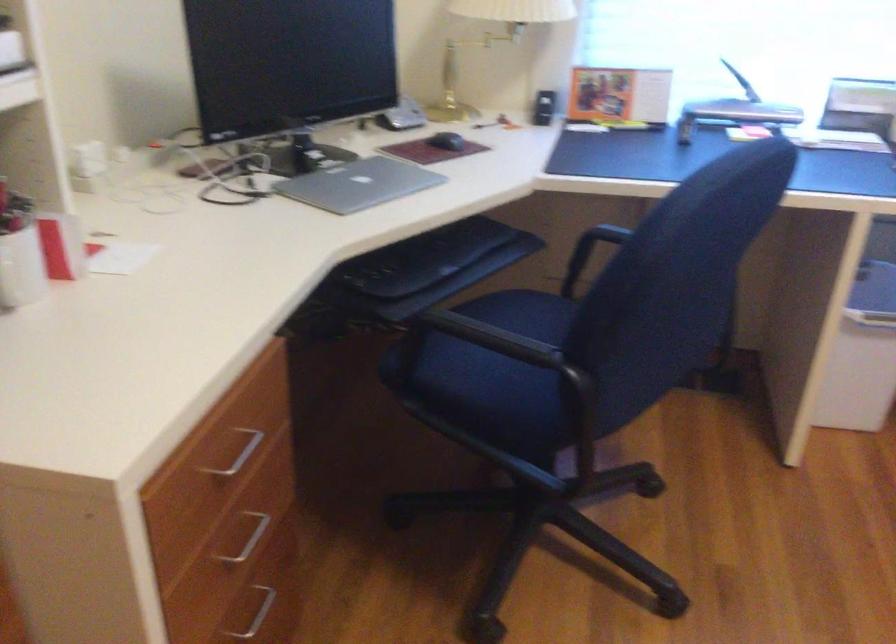
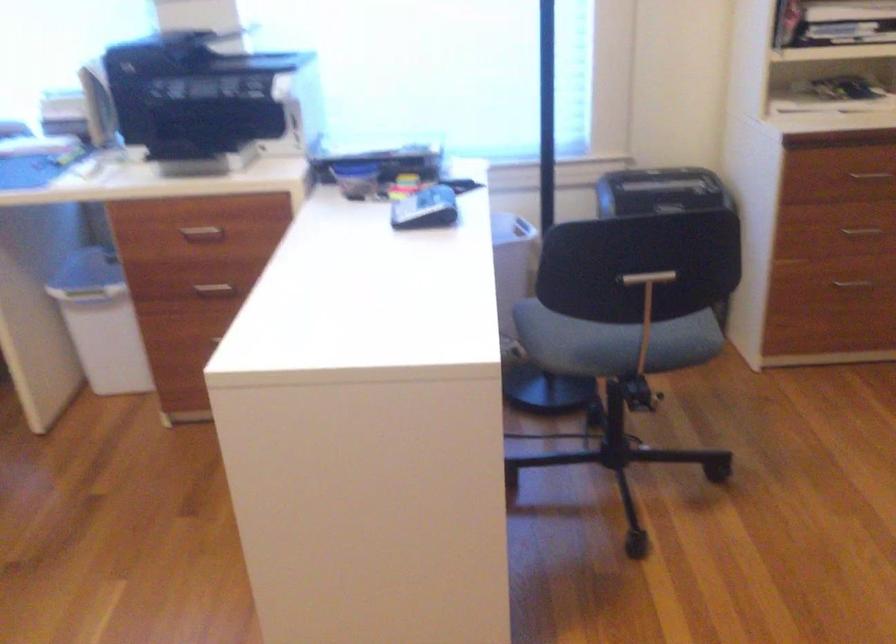
Question: What movement of the cameraman would produce the second image?

Choices:
 (A) Left
 (B) Right
 (C) Forward
 (D) Backward

Answer: (B)